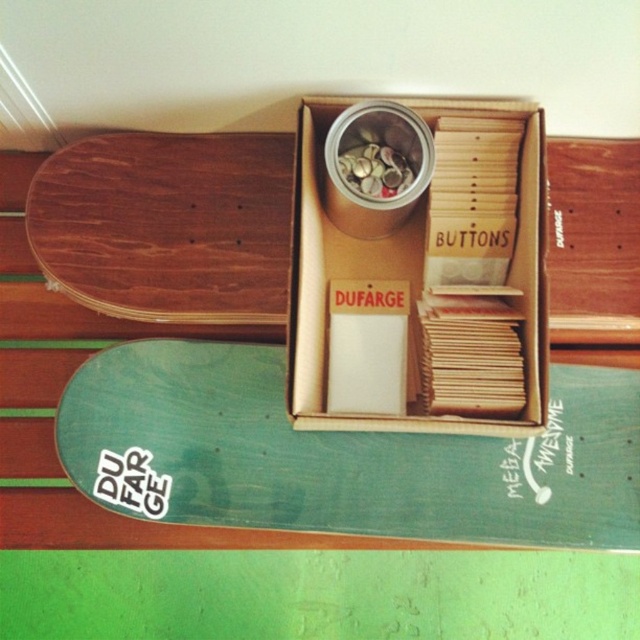
You are organizing a craft workshop and need to access the brown cardboard box at center. Can you easily reach it without moving the green matte skateboard at lower left?

The green matte skateboard at lower left is positioned under the brown cardboard box at center, so you cannot easily reach the brown cardboard box at center without moving the skateboard first.

You are organizing a craft workshop and need to place the brown cardboard box at center and the wooden skateboard at upper left into a storage cabinet. The cabinet has a shelf that can only hold items up to 15 inches in length. Which item should you place first to ensure both fit on the shelf?

The brown cardboard box at center is larger in size than the wooden skateboard at upper left. Therefore, you should place the brown cardboard box at center first to ensure both items fit on the shelf.

Consider the image. You are organizing your craft supplies and need to place a new item between the green matte skateboard at lower left and the brown cardboard box at center. Can you fit it there?

The green matte skateboard at lower left is to the left of the brown cardboard box at center, so there is space between them where you can place your new item.